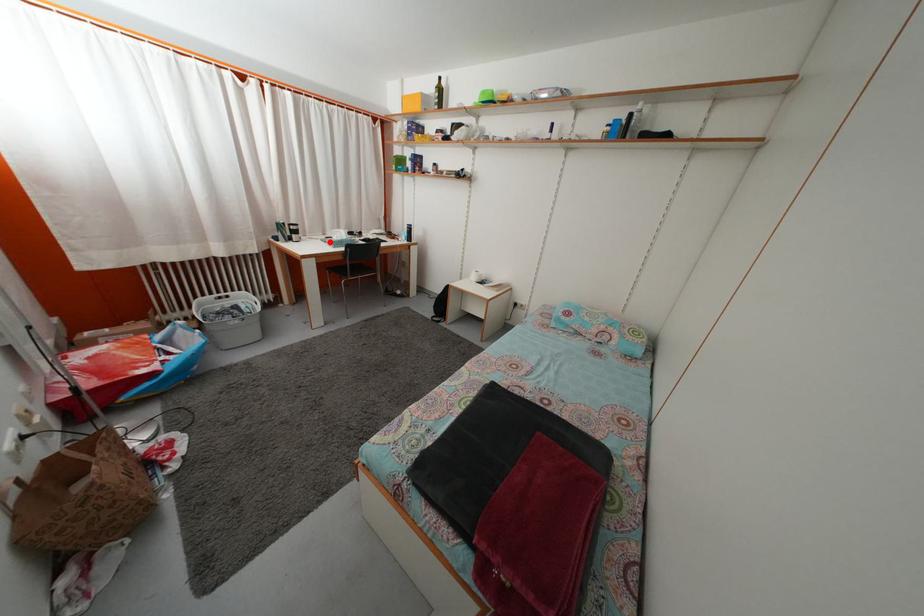
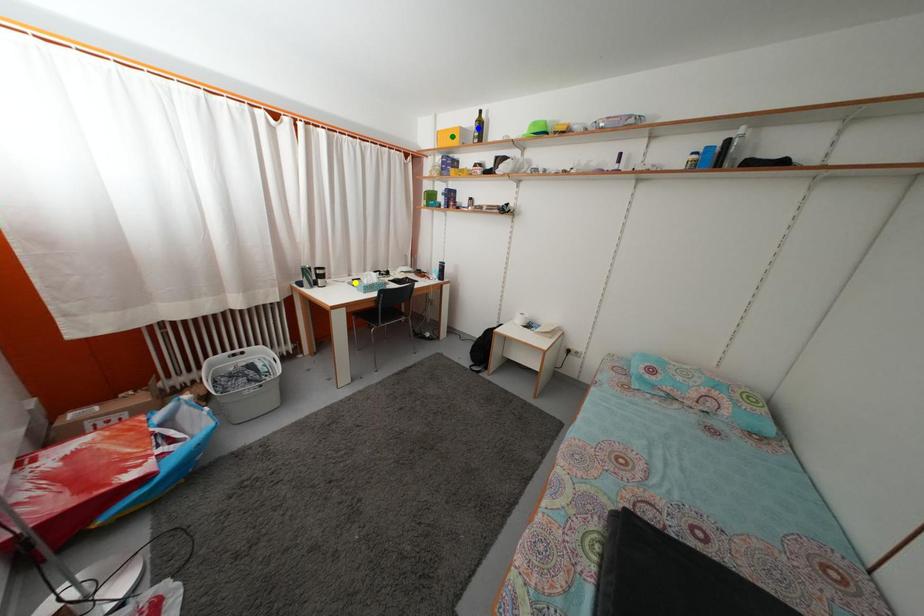
Question: I am providing you with two images of the same scene from different viewpoints. A red point is marked on the first image. You are given multiple points on the second image. Can you choose the point in image 2 that corresponds to the point in image 1?

Choices:
 (A) green point
 (B) blue point
 (C) yellow point

Answer: (C)